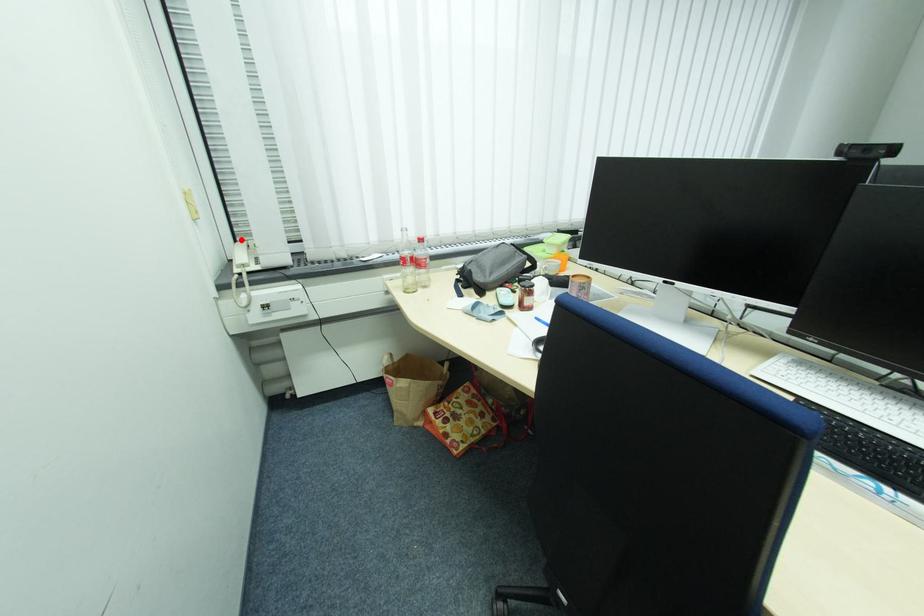
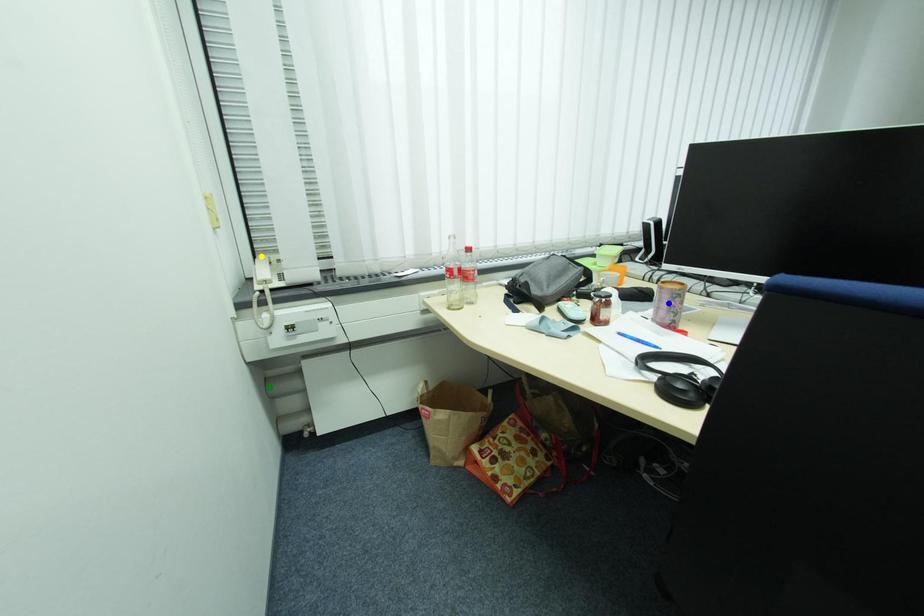
Question: I am providing you with two images of the same scene from different viewpoints. A red point is marked on the first image. You are given multiple points on the second image. Can you choose the point in image 2 that corresponds to the point in image 1?

Choices:
 (A) yellow point
 (B) blue point
 (C) green point

Answer: (A)